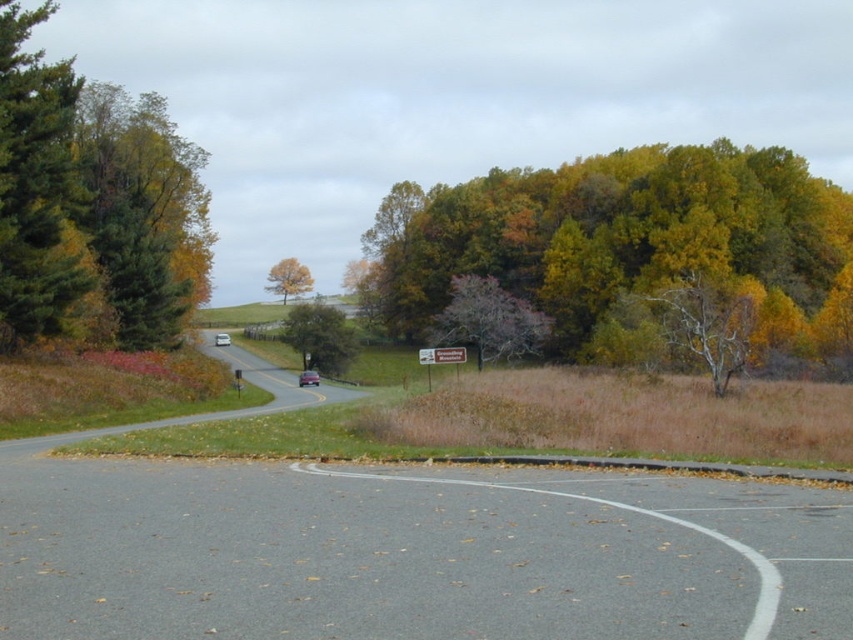
You are standing at the point labeled point (320, 337) on the scenic rural road. Looking around, you see the green matte tree at center. What is the nearest object to your current position?

The nearest object to point (320, 337) is the green matte tree at center since the point is located on it.

Based on the photo, you are driving along the rural road and want to know if the pink textured tree at center is closer to you than the wooden sign at center. Based on the scene, can you determine this?

The pink textured tree at center is further to the viewer than wooden sign at center, so no, the pink textured tree at center is not closer to you than the wooden sign at center.